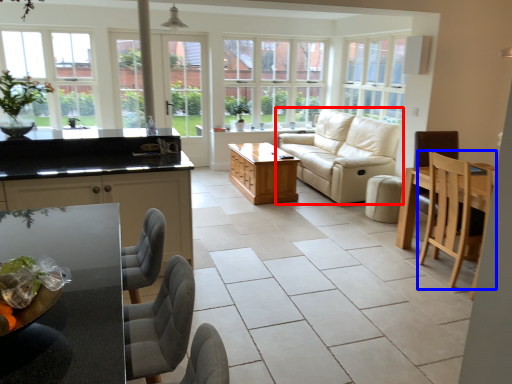
Question: Which object is further to the camera taking this photo, studio couch (highlighted by a red box) or chair (highlighted by a blue box)?

Choices:
 (A) studio couch
 (B) chair

Answer: (A)